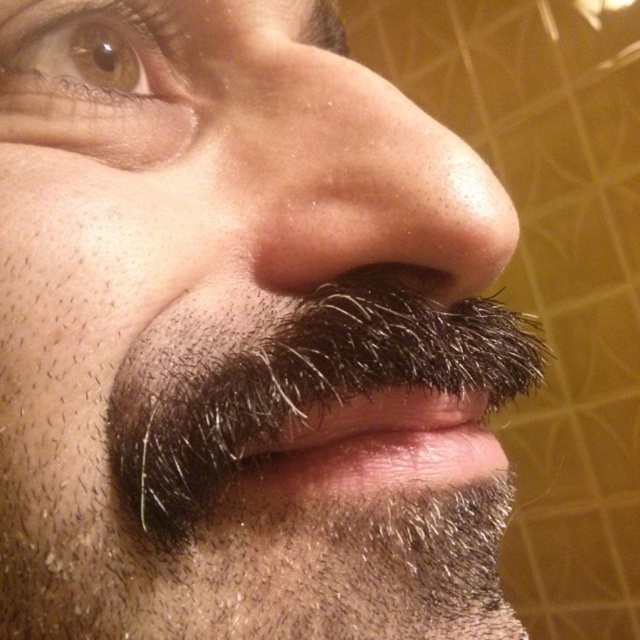
Question: Among these points, which one is farthest from the camera?

Choices:
 (A) (369, 168)
 (B) (120, 56)
 (C) (416, 476)

Answer: (B)

Question: Can you confirm if smooth skin nose at center is smaller than brown matte eye at upper left?

Choices:
 (A) no
 (B) yes

Answer: (A)

Question: Which object is closer to the camera taking this photo?

Choices:
 (A) brown matte eye at upper left
 (B) dark brown fur at center
 (C) smooth skin nose at center

Answer: (C)

Question: Is brown matte eye at upper left in front of dark brown fur at center?

Choices:
 (A) no
 (B) yes

Answer: (A)

Question: Is smooth skin nose at center closer to camera compared to brown matte eye at upper left?

Choices:
 (A) yes
 (B) no

Answer: (A)

Question: Which of the following is the farthest from the observer?

Choices:
 (A) (404, 228)
 (B) (481, 401)

Answer: (B)